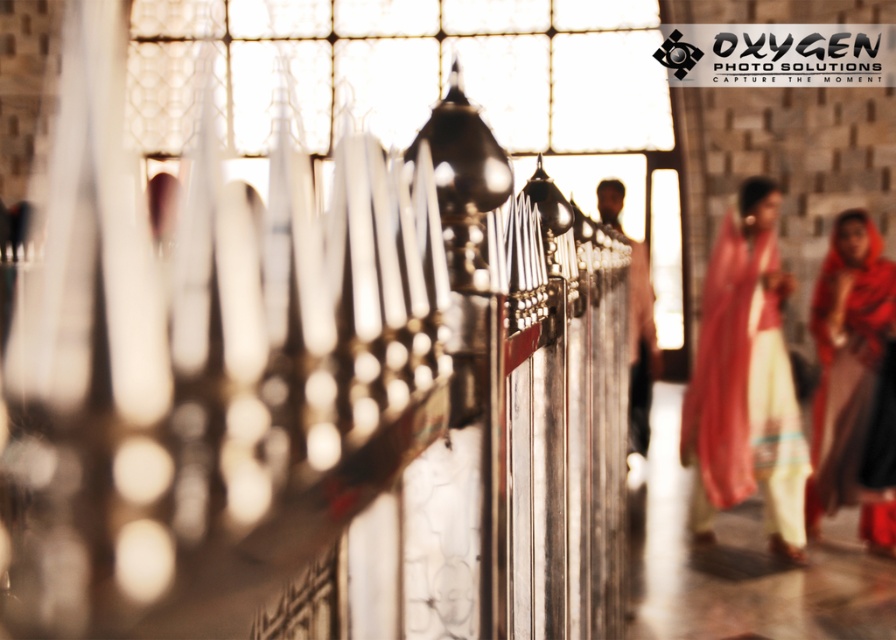
From the picture: Which is above, matte red fabric at right or matte brown shirt at center?

Positioned higher is matte brown shirt at center.

Does matte red fabric at right appear on the right side of matte brown shirt at center?

Yes, matte red fabric at right is to the right of matte brown shirt at center.

Does point (840, 257) come behind point (638, 440)?

No, (840, 257) is closer to viewer.

In order to click on matte red fabric at right in this screenshot , I will do `click(845, 337)`.

Can you confirm if matte pink fabric at right is smaller than matte brown shirt at center?

No.

Does matte pink fabric at right appear under matte brown shirt at center?

Indeed, matte pink fabric at right is positioned under matte brown shirt at center.

What do you see at coordinates (745, 385) in the screenshot? The width and height of the screenshot is (896, 640). I see `matte pink fabric at right` at bounding box center [745, 385].

Find the location of `matte pink fabric at right`. matte pink fabric at right is located at coordinates (745, 385).

Is matte pink fabric at right to the right of matte red fabric at right from the viewer's perspective?

No, matte pink fabric at right is not to the right of matte red fabric at right.

Is matte pink fabric at right to the left of matte red fabric at right from the viewer's perspective?

Yes, matte pink fabric at right is to the left of matte red fabric at right.

Where is `matte pink fabric at right`? matte pink fabric at right is located at coordinates (745, 385).